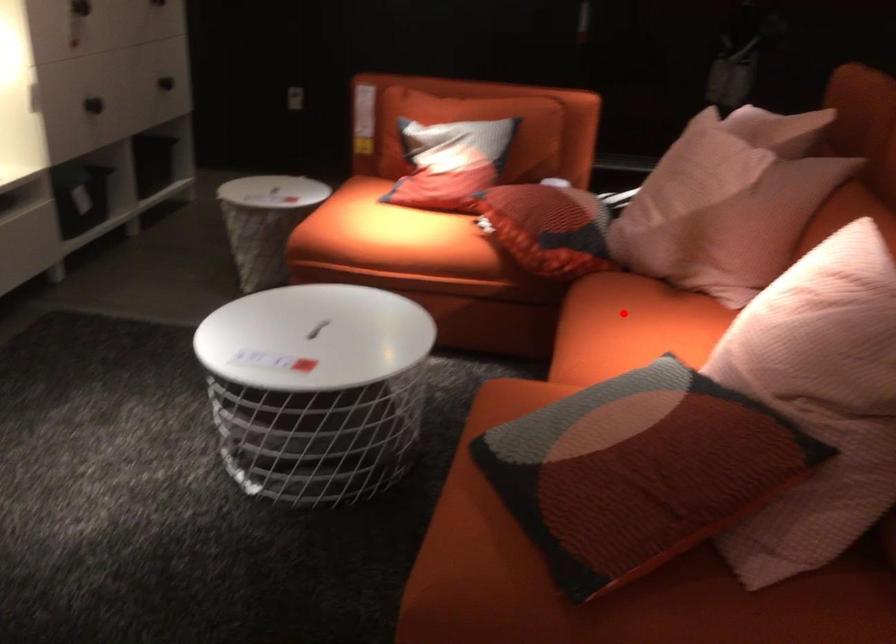
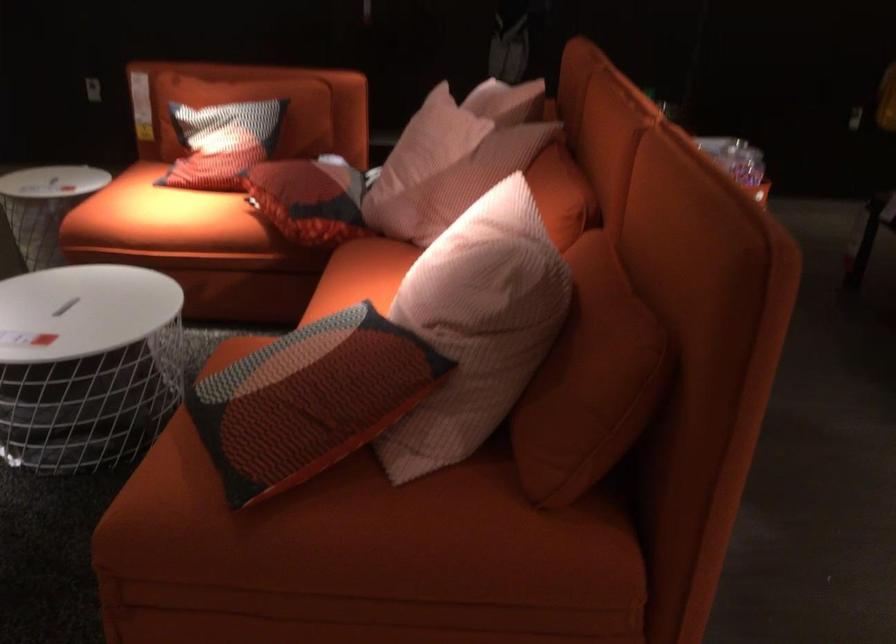
The point at the highlighted location is marked in the first image. Where is the corresponding point in the second image?

(360, 276)